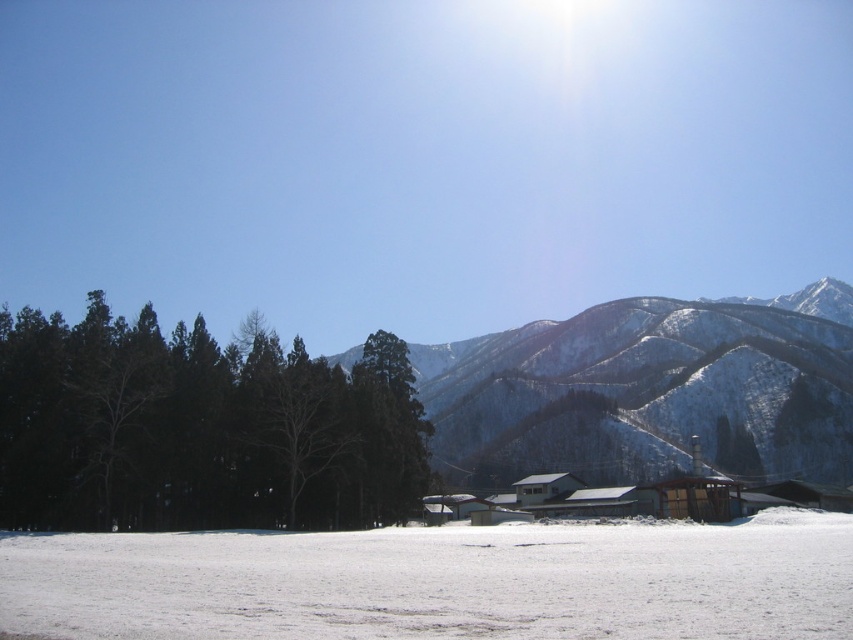
Is white snow at lower center shorter than snowy textured mountain at center?

Correct, white snow at lower center is not as tall as snowy textured mountain at center.

Does white snow at lower center come behind snowy textured mountain at center?

No, white snow at lower center is in front of snowy textured mountain at center.

The image size is (853, 640). I want to click on white snow at lower center, so 440,582.

Find the location of a particular element. Image resolution: width=853 pixels, height=640 pixels. white snow at lower center is located at coordinates [x=440, y=582].

Between white snow at lower center and green matte trees at left, which one appears on the left side from the viewer's perspective?

green matte trees at left

Who is lower down, white snow at lower center or green matte trees at left?

Positioned lower is white snow at lower center.

Is point (328, 568) more distant than point (22, 426)?

No, (328, 568) is closer to viewer.

Find the location of a particular element. white snow at lower center is located at coordinates (440, 582).

Based on the photo, does snowy textured mountain at center have a lesser height compared to green matte tree at center?

No.

Can you confirm if snowy textured mountain at center is positioned above green matte tree at center?

Indeed, snowy textured mountain at center is positioned over green matte tree at center.

Identify the location of snowy textured mountain at center. The height and width of the screenshot is (640, 853). (650, 392).

Locate an element on the screen. This screenshot has width=853, height=640. snowy textured mountain at center is located at coordinates (650, 392).